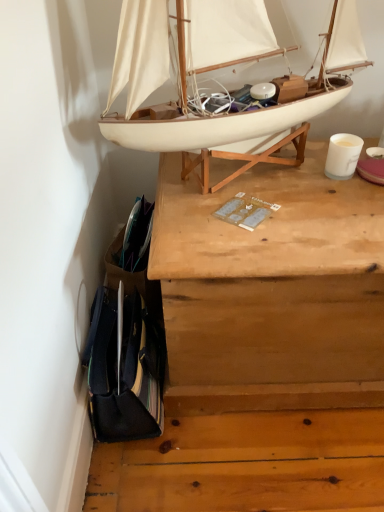
Identify the location of vacant space in front of white matte boat at upper center. This screenshot has width=384, height=512. (263, 231).